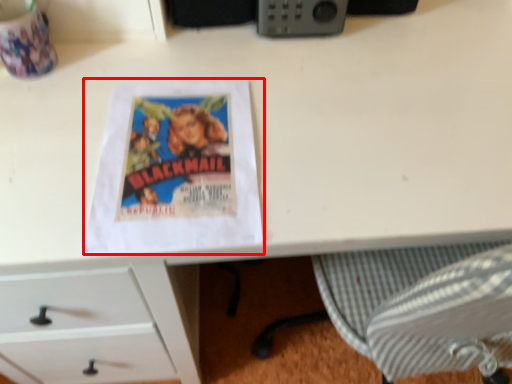
Question: From the image's perspective, where is paperback book (annotated by the red box) located in relation to gadget in the image?

Choices:
 (A) above
 (B) below

Answer: (B)